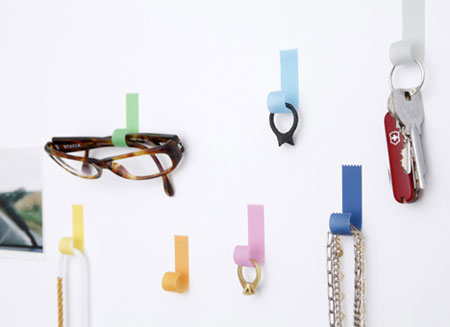
Find the location of a particular element. The image size is (450, 327). white wall is located at coordinates coord(211,77).